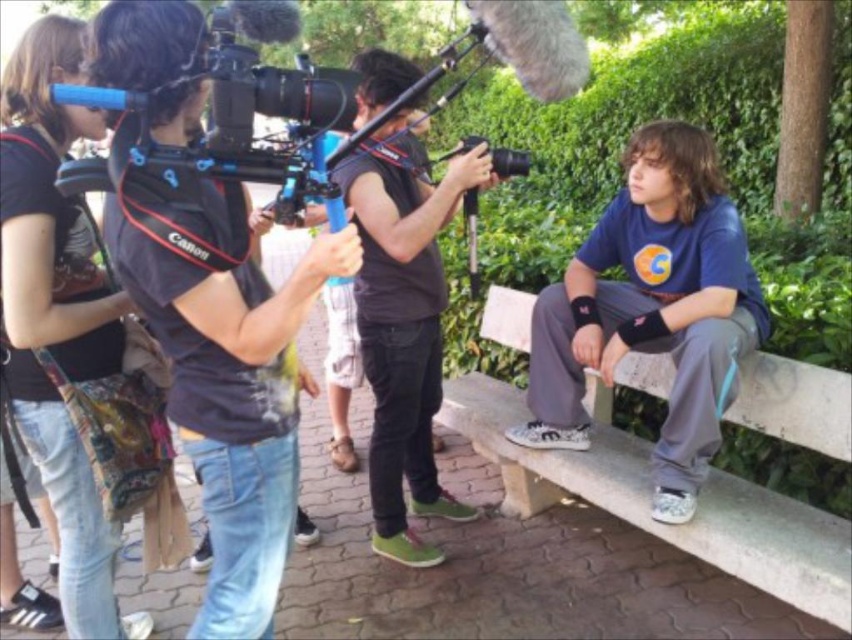
Does black fabric camera at center come behind dark brown leather jacket at center?

No, it is not.

Can you confirm if black fabric camera at center is thinner than dark brown leather jacket at center?

Incorrect, black fabric camera at center's width is not less than dark brown leather jacket at center's.

Is point (255, 548) in front of point (369, 280)?

Yes, it is.

Locate an element on the screen. black fabric camera at center is located at coordinates (229, 385).

Is concrete bench at right smaller than dark brown leather jacket at center?

Actually, concrete bench at right might be larger than dark brown leather jacket at center.

Who is positioned more to the right, concrete bench at right or dark brown leather jacket at center?

concrete bench at right is more to the right.

Which is in front, point (536, 465) or point (389, 237)?

Point (389, 237) is more forward.

In order to click on concrete bench at right in this screenshot , I will do `click(649, 496)`.

Does blue cotton shirt at right appear on the right side of dark brown leather jacket at center?

Indeed, blue cotton shirt at right is positioned on the right side of dark brown leather jacket at center.

In order to click on blue cotton shirt at right in this screenshot , I will do `click(652, 308)`.